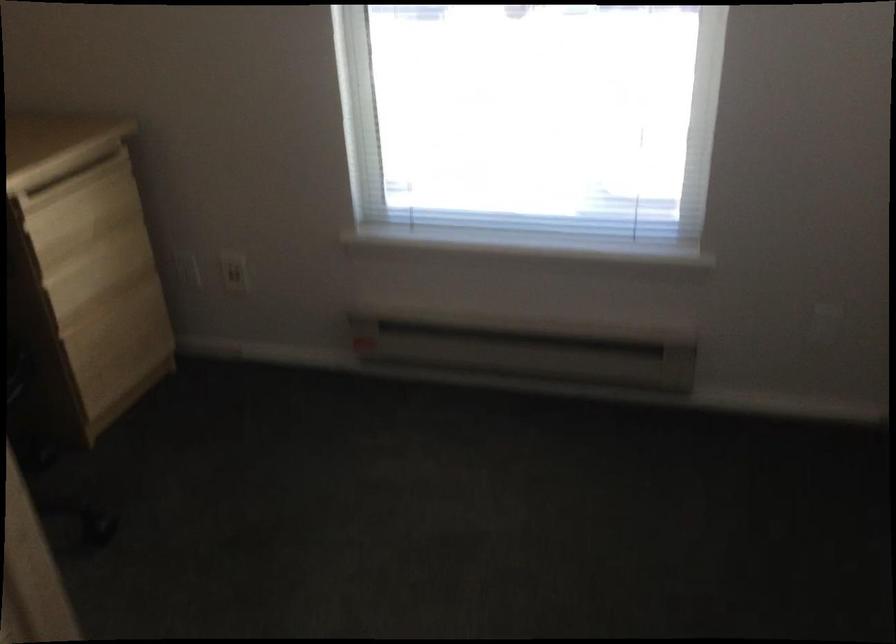
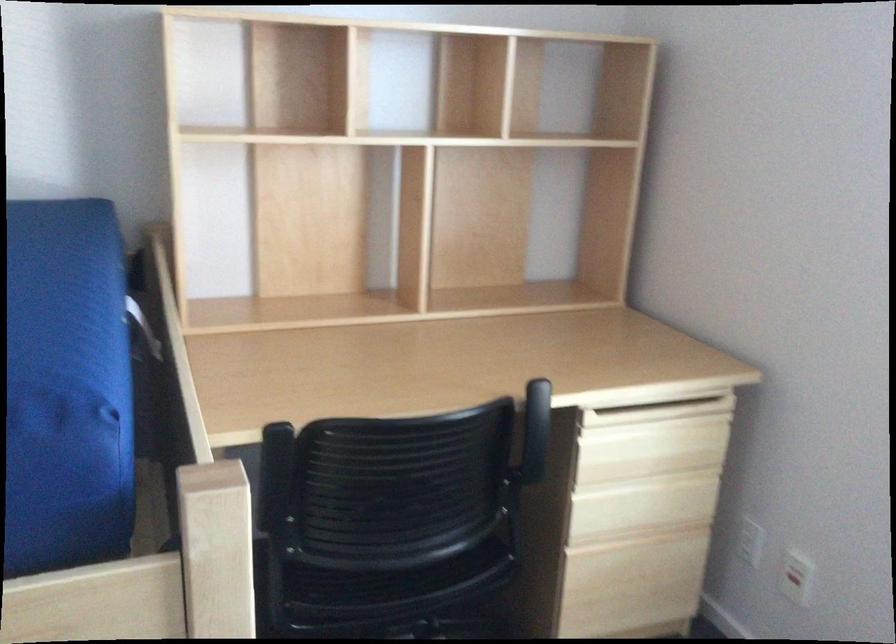
Find the pixel in the second image that matches pixel 237 275 in the first image.

(795, 583)